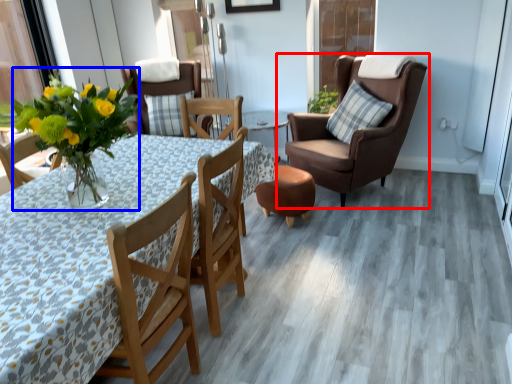
Question: Which object is closer to the camera taking this photo, chair (highlighted by a red box) or floral arrangement (highlighted by a blue box)?

Choices:
 (A) chair
 (B) floral arrangement

Answer: (B)